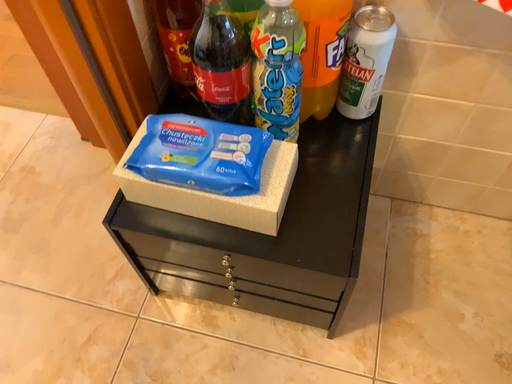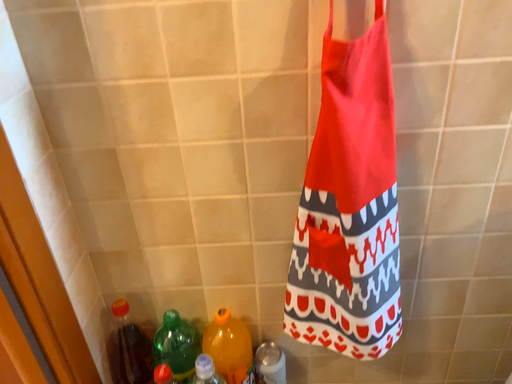
Question: Which way did the camera rotate in the video?

Choices:
 (A) rotated upward
 (B) rotated downward

Answer: (A)